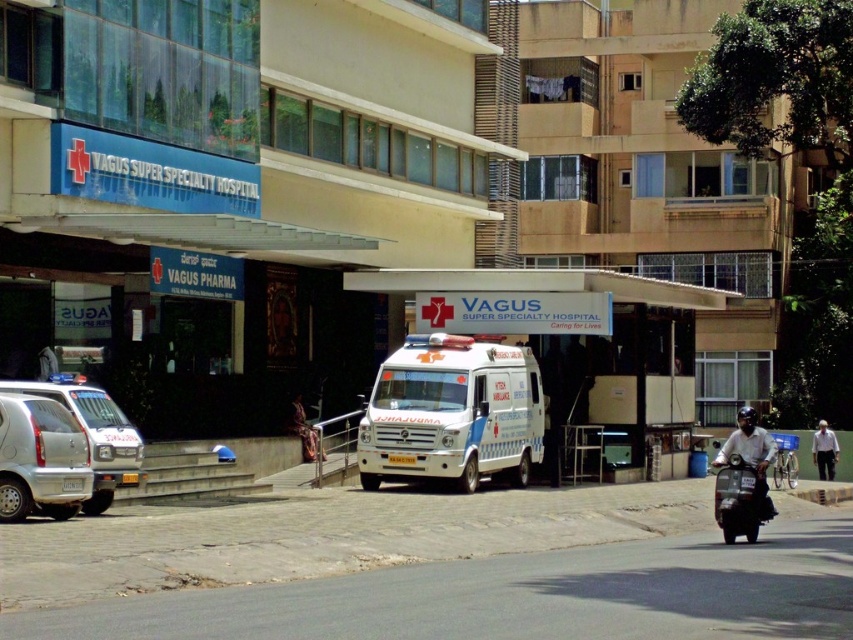
Between silver metallic van at left and white cotton shirt at lower right, which one has more height?

silver metallic van at left

Can you confirm if silver metallic van at left is taller than white cotton shirt at lower right?

Yes, silver metallic van at left is taller than white cotton shirt at lower right.

This screenshot has width=853, height=640. What do you see at coordinates (94, 433) in the screenshot?
I see `silver metallic van at left` at bounding box center [94, 433].

Locate an element on the screen. This screenshot has width=853, height=640. silver metallic van at left is located at coordinates (94, 433).

Consider the image. Is white glossy ambulance at center positioned in front of white cotton shirt at lower right?

Yes, it is.

Does point (375, 481) come farther from viewer compared to point (825, 480)?

No.

Identify the location of white glossy ambulance at center. This screenshot has width=853, height=640. (451, 413).

Which is behind, point (399, 369) or point (734, 522)?

The point (399, 369) is more distant.

Can you confirm if white glossy ambulance at center is shorter than shiny black scooter at lower right?

No.

Who is more forward, (463, 360) or (744, 513)?

Point (744, 513) is more forward.

Locate an element on the screen. The width and height of the screenshot is (853, 640). white glossy ambulance at center is located at coordinates click(451, 413).